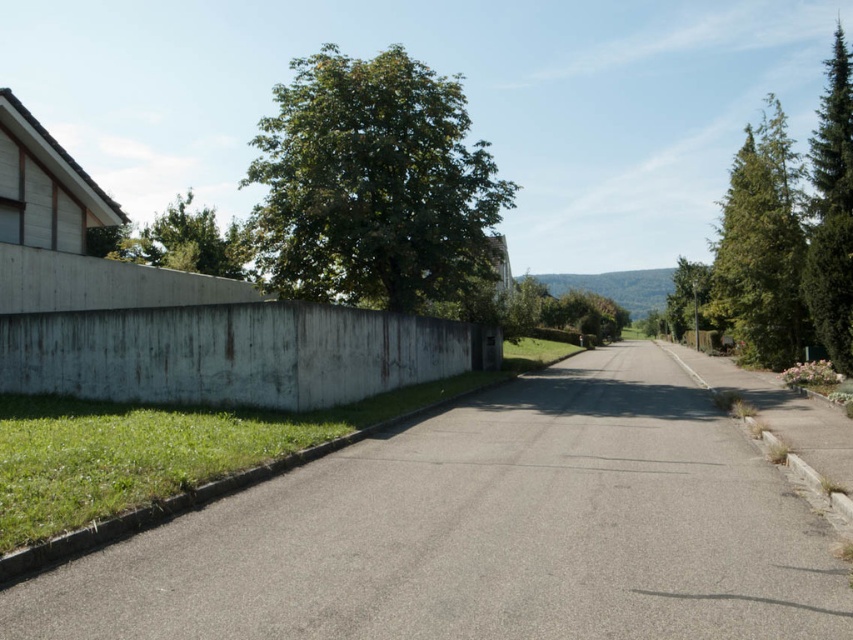
Question: Which object appears farthest from the camera in this image?

Choices:
 (A) green leafy tree at upper left
 (B) green leafy tree at center

Answer: (A)

Question: Does green textured tree at right come in front of green coniferous tree at right?

Choices:
 (A) no
 (B) yes

Answer: (B)

Question: Can you confirm if gray asphalt driveway at center is positioned above green coniferous tree at right?

Choices:
 (A) no
 (B) yes

Answer: (A)

Question: Is the position of green leafy tree at center more distant than that of green textured tree at right?

Choices:
 (A) yes
 (B) no

Answer: (A)

Question: Considering the real-world distances, which object is closest to the green leafy tree at upper left?

Choices:
 (A) gray concrete wall at left
 (B) green coniferous tree at right

Answer: (A)

Question: Among these points, which one is nearest to the camera?

Choices:
 (A) (233, 248)
 (B) (776, 243)
 (C) (74, 612)
 (D) (849, 282)

Answer: (C)